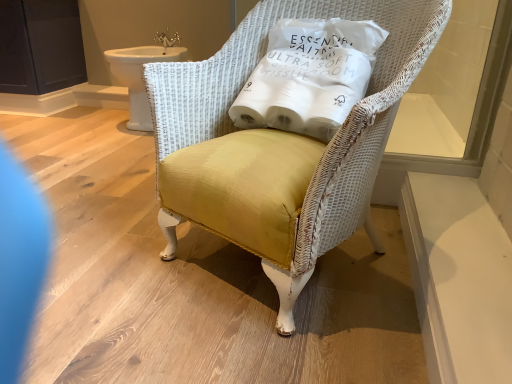
Where is `vacant space positioned to the left of white ceramic sink at upper left`? vacant space positioned to the left of white ceramic sink at upper left is located at coordinates (68, 121).